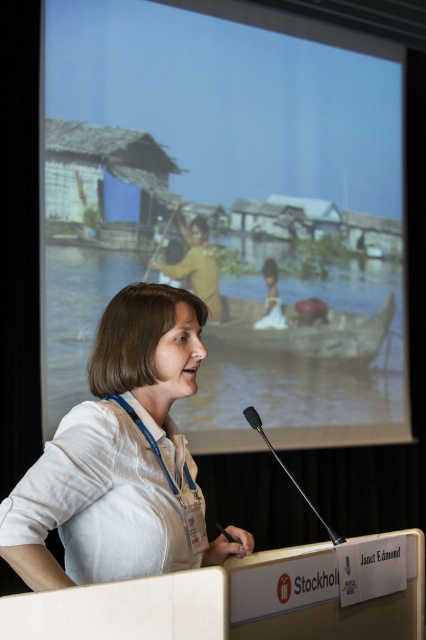
Based on the scene description, which object is positioned lower in the image, the wooden boat at center or the yellow matte shirt at center?

The wooden boat at center is positioned below the yellow matte shirt at center, so the wooden boat at center is lower in the image.

You are attending a presentation by Janet Edmond at World Water Week. During her talk, she points to two points on the projected rural scene behind her. The first point is at coordinates point (x=281, y=349) and the second is at point (x=204, y=291). From your seat in the audience, which point is closer to you?

Point (x=204, y=291) is closer to you because it is in front of point (x=281, y=349).